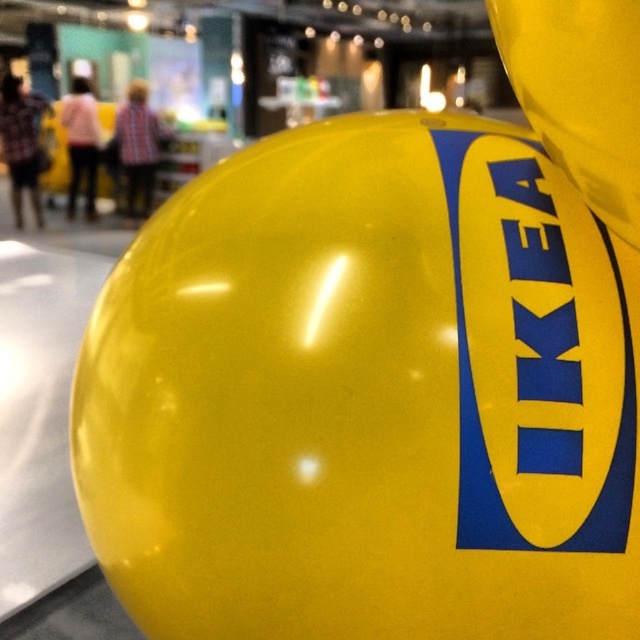
Is yellow rubber balloon at center to the left of yellow rubber balloon at upper right from the viewer's perspective?

Correct, you'll find yellow rubber balloon at center to the left of yellow rubber balloon at upper right.

What do you see at coordinates (368, 396) in the screenshot?
I see `yellow rubber balloon at center` at bounding box center [368, 396].

This screenshot has width=640, height=640. Identify the location of yellow rubber balloon at center. (368, 396).

Does yellow rubber balloon at center have a greater width compared to yellow glossy ikea logo at center?

Yes, yellow rubber balloon at center is wider than yellow glossy ikea logo at center.

The image size is (640, 640). What do you see at coordinates (368, 396) in the screenshot? I see `yellow rubber balloon at center` at bounding box center [368, 396].

Identify the location of yellow rubber balloon at center. The width and height of the screenshot is (640, 640). (368, 396).

From the picture: Is yellow glossy ikea logo at center positioned before yellow rubber balloon at upper right?

No, yellow glossy ikea logo at center is further to the viewer.

Is point (449, 209) less distant than point (588, 188)?

That is False.

Identify the location of yellow glossy ikea logo at center. (x=536, y=353).